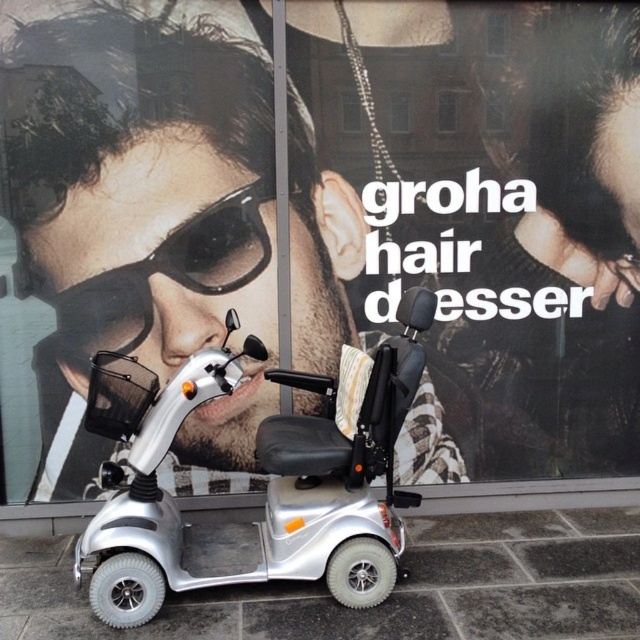
Does silver metallic mobility scooter at center have a lesser height compared to matte black goggles at center?

In fact, silver metallic mobility scooter at center may be taller than matte black goggles at center.

Is silver metallic mobility scooter at center bigger than matte black goggles at center?

Indeed, silver metallic mobility scooter at center has a larger size compared to matte black goggles at center.

Who is more forward, (147, 417) or (84, 326)?

Point (147, 417) is in front.

The image size is (640, 640). I want to click on silver metallic mobility scooter at center, so click(x=260, y=468).